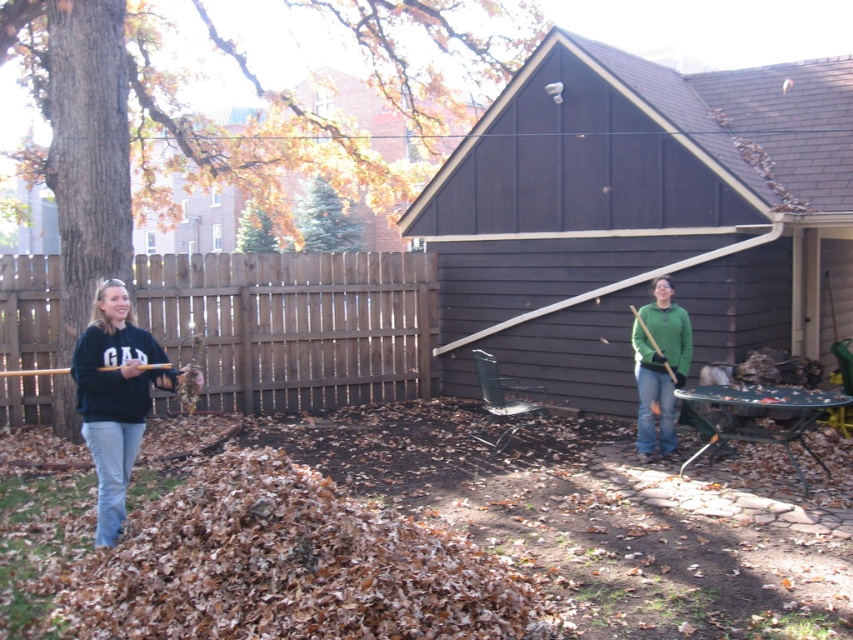
Question: Which point is farther from the camera taking this photo?

Choices:
 (A) (102, 445)
 (B) (38, 349)

Answer: (B)

Question: Which object is the farthest from the black sweatshirt at left?

Choices:
 (A) brown wooden fence at center
 (B) green matte sweater at center

Answer: (A)

Question: Considering the relative positions of black sweatshirt at left and green matte sweater at center in the image provided, where is black sweatshirt at left located with respect to green matte sweater at center?

Choices:
 (A) above
 (B) below

Answer: (B)

Question: Estimate the real-world distances between objects in this image. Which object is closer to the brown wooden fence at center?

Choices:
 (A) green matte sweater at center
 (B) black sweatshirt at left

Answer: (A)

Question: Is brown wooden fence at center closer to camera compared to black sweatshirt at left?

Choices:
 (A) yes
 (B) no

Answer: (B)

Question: Is black sweatshirt at left closer to camera compared to green matte sweater at center?

Choices:
 (A) yes
 (B) no

Answer: (A)